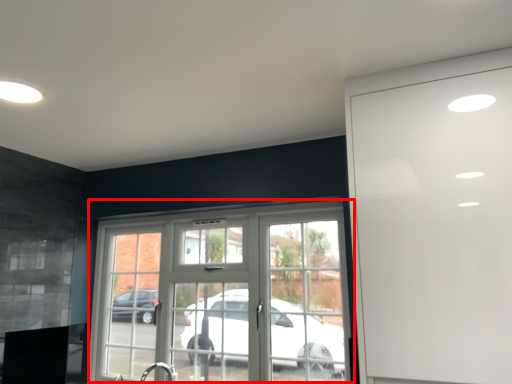
Question: From the image's perspective, where is window (annotated by the red box) located relative to garage door?

Choices:
 (A) above
 (B) below

Answer: (B)